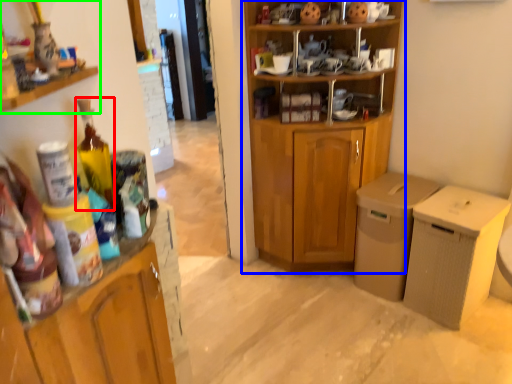
Question: Which object is the farthest from bottle (highlighted by a red box)? Choose among these: cupboard (highlighted by a blue box) or cabinetry (highlighted by a green box).

Choices:
 (A) cupboard
 (B) cabinetry

Answer: (A)